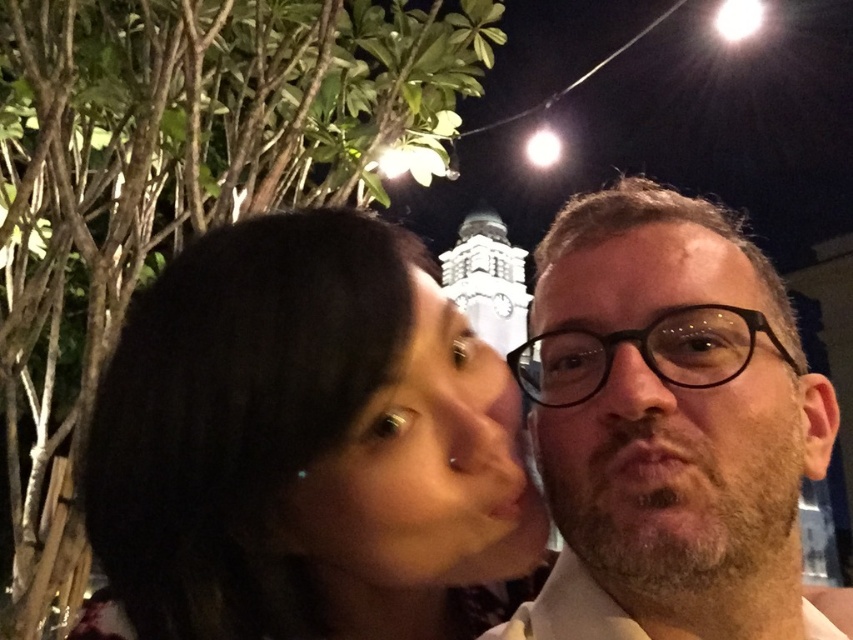
You are a photographer trying to capture a closeup shot of the dark brown hair at center and the black plastic glasses at center in the scene. Given that your camera can only focus on objects within a 50 feet range, will you be able to capture both objects clearly in the same frame?

The dark brown hair at center and black plastic glasses at center are 53.63 feet apart from each other. Since the distance between them exceeds the camera lens focus range of 50 feet, capturing both clearly in the same frame would not be possible.

You are standing in the nighttime scene and want to place a small decoration between the two points, point [334,625] and point [465,509]. Which point should the decoration be closer to in order to appear closer to the foreground?

The decoration should be closer to point [334,625] because it is closer to the viewer than point [465,509].